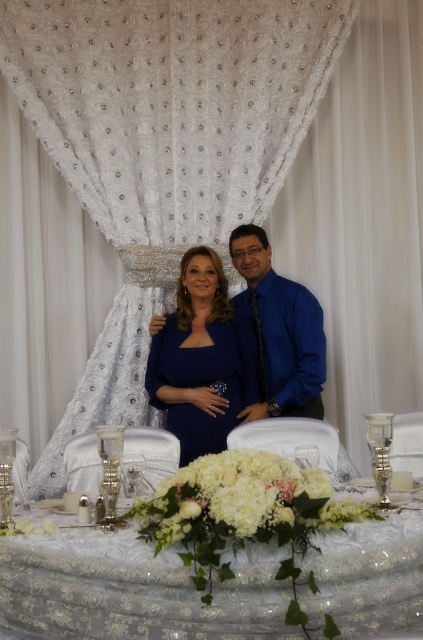
You are a photographer at the event and want to capture a closeup of the white floral arrangement at center and the blue satin shirt at center. Which object should you focus on first to ensure it appears sharp in the photo?

The white floral arrangement at center is closer to the viewer than the blue satin shirt at center, so you should focus on the white floral arrangement at center first to ensure it is sharp.

You are standing at the entrance of the reception hall and want to take a photo of the table with the point at coordinates point (170, 392). If your camera has a maximum focus range of 3 meters, will you be able to focus on that point?

The distance of point (170, 392) from viewer is 3.47 meters, so the camera cannot focus on that point since it exceeds the maximum range of 3 meters.